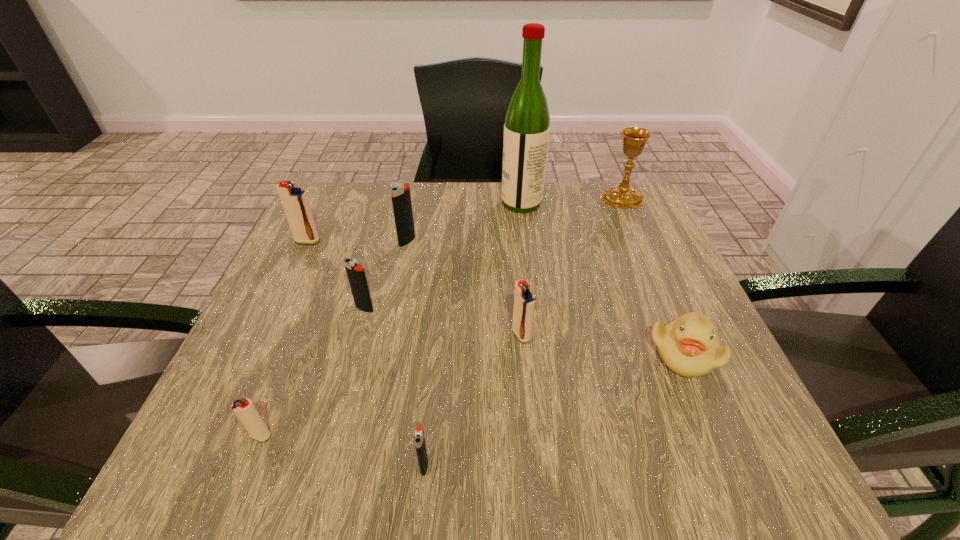
In the image, there is a desktop. At what (x,y) coordinates should I click in order to perform the action: click on vacant region at the far right corner. Please return your answer as a coordinate pair (x, y). Looking at the image, I should click on (582, 186).

Locate an element on the screen. vacant space at the near right corner of the desktop is located at coordinates tap(766, 464).

The width and height of the screenshot is (960, 540). In order to click on unoccupied area between the second smallest red igniter and the second smallest black igniter in this screenshot , I will do `click(443, 322)`.

This screenshot has width=960, height=540. Find the location of `vacant region between the second farthest black igniter and the sixth object from right to left`. vacant region between the second farthest black igniter and the sixth object from right to left is located at coordinates (386, 275).

Where is `free space between the smallest red igniter and the leftmost igniter`? This screenshot has width=960, height=540. free space between the smallest red igniter and the leftmost igniter is located at coordinates 284,338.

The image size is (960, 540). What are the coordinates of `free spot between the nearest black igniter and the third igniter from right to left` in the screenshot? It's located at (416, 354).

Locate an element on the screen. empty space that is in between the yellow duckling and the biggest black igniter is located at coordinates (545, 298).

You are a GUI agent. You are given a task and a screenshot of the screen. Output one action in this format:
    pyautogui.click(x=<x>, y=<y>)
    Task: Click on the vacant point located between the nearest igniter and the second nearest red igniter
    The height and width of the screenshot is (540, 960).
    Given the screenshot: What is the action you would take?
    pyautogui.click(x=472, y=400)

Locate an element on the screen. This screenshot has height=540, width=960. vacant region between the liquor and the fifth farthest object is located at coordinates (443, 256).

Identify the location of vacant point located between the second black igniter from right to left and the biggest red igniter. (357, 241).